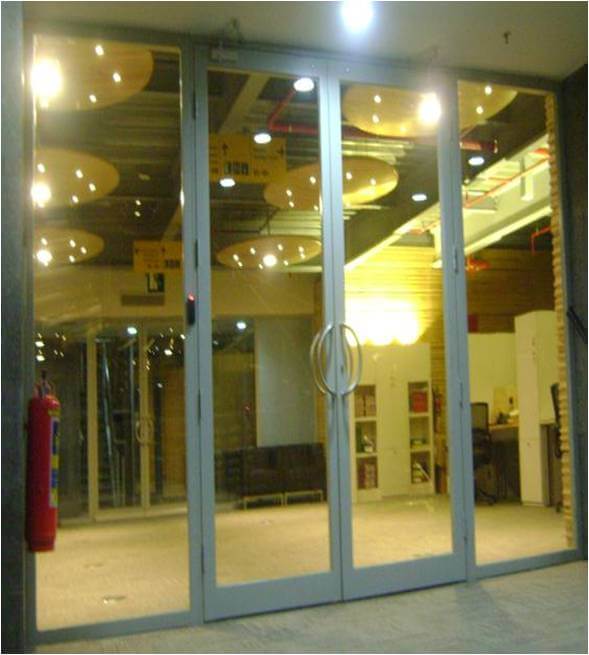
I want to click on hinge, so click(198, 409), click(203, 555), click(190, 249), click(198, 115), click(464, 394), click(466, 528), click(449, 126), click(456, 259).